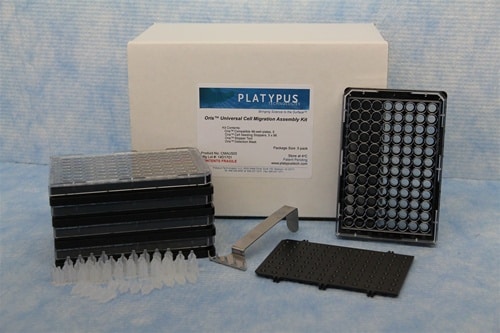
Locate an element on the screen. wall is located at coordinates (468, 106).